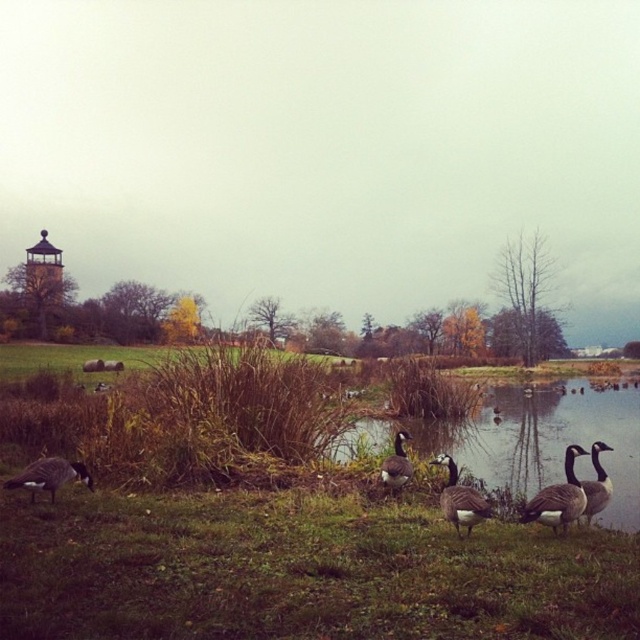
Question: Which point is closer to the camera?

Choices:
 (A) gray matte duck at lower right
 (B) gray matte duck at center
 (C) green grass at lower center

Answer: (C)

Question: Does gray matte goose at center appear on the right side of gray matte duck at center?

Choices:
 (A) yes
 (B) no

Answer: (A)

Question: Which object is the closest to the gray matte duck at lower right?

Choices:
 (A) gray matte goose at lower left
 (B) dark gray feathers at lower right

Answer: (B)

Question: Is gray matte goose at center bigger than gray matte goose at lower left?

Choices:
 (A) yes
 (B) no

Answer: (B)

Question: Which object is closer to the camera taking this photo?

Choices:
 (A) gray matte duck at lower right
 (B) gray matte duck at center

Answer: (A)

Question: Can you confirm if gray matte goose at lower left is thinner than dark gray feathers at lower right?

Choices:
 (A) no
 (B) yes

Answer: (A)